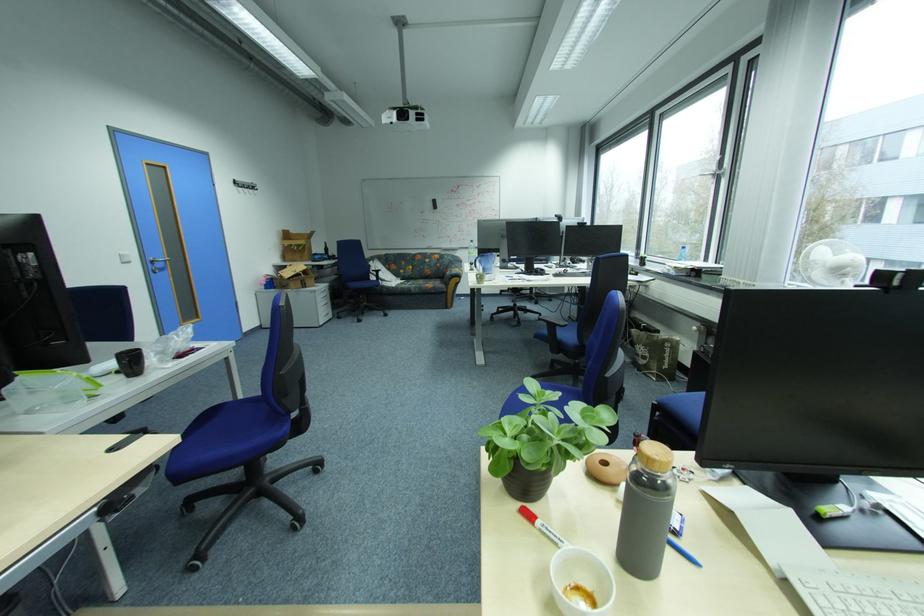
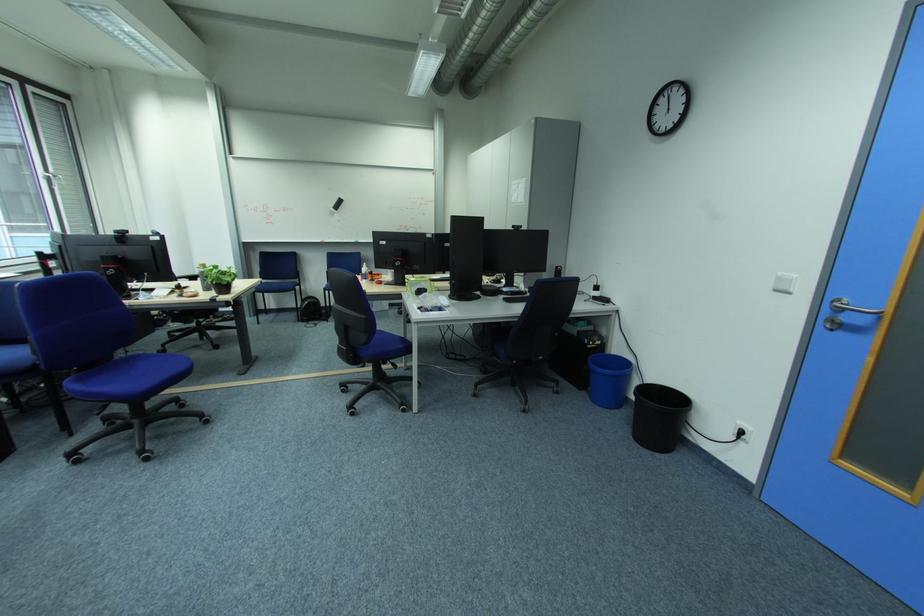
The point at [131,264] is marked in the first image. Where is the corresponding point in the second image?

(785, 292)